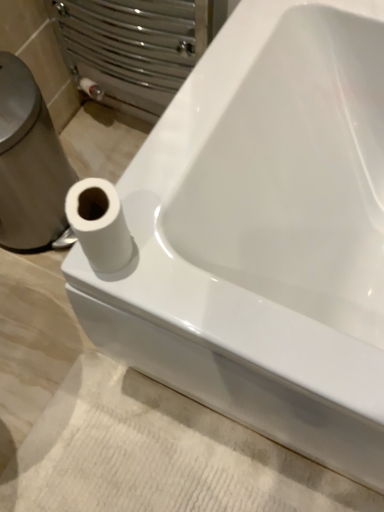
Question: Considering the relative positions of white matte toilet paper at lower left and white glossy toilet paper at left in the image provided, is white matte toilet paper at lower left to the left or to the right of white glossy toilet paper at left?

Choices:
 (A) left
 (B) right

Answer: (B)

Question: Considering their positions, is white matte toilet paper at lower left located in front of or behind white glossy toilet paper at left?

Choices:
 (A) front
 (B) behind

Answer: (A)

Question: Estimate the real-world distances between objects in this image. Which object is farther from the white matte toilet paper at lower left?

Choices:
 (A) white glossy toilet paper at left
 (B) white textured bath mat at lower left

Answer: (B)

Question: Considering the real-world distances, which object is closest to the white matte toilet paper at lower left?

Choices:
 (A) white textured bath mat at lower left
 (B) white glossy toilet paper at left

Answer: (B)